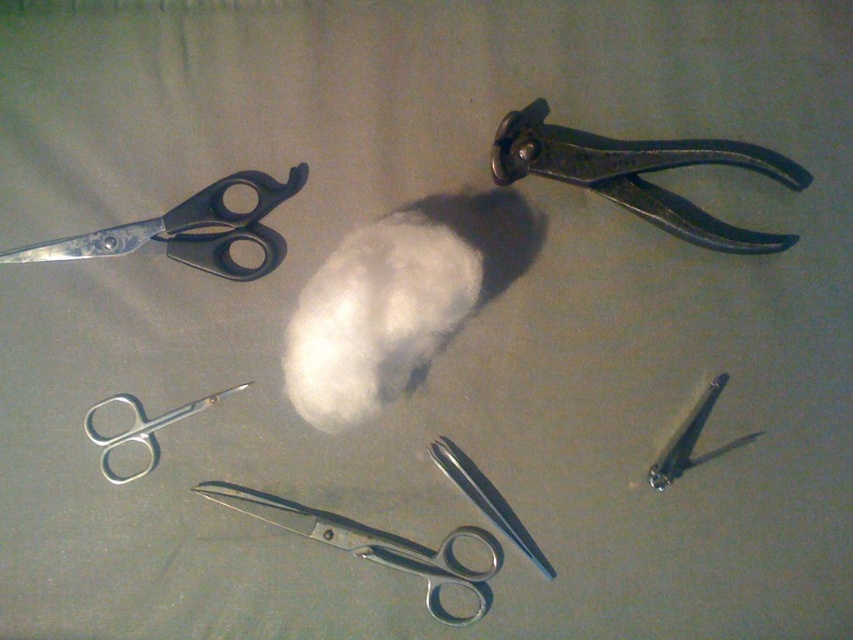
You are organizing tools on a workbench and need to place a new tool between the metallic scissors at center and the metallic silver nail at center. The new tool requires at least 25 centimeters of space. Is there enough space between them?

The distance between the metallic scissors at center and the metallic silver nail at center is 20.37 centimeters, which is less than the required 25 centimeters. Therefore, there is not enough space to place the new tool between them.

You have a small container that can only fit items wider than 5 centimeters. You need to place either the metallic scissors at center or the metallic silver nail at center into it. Which item should you choose?

The metallic scissors at center should be chosen because its width is larger than the metallic silver nail at center, making it more likely to fit in the container that requires items wider than 5 centimeters.

You are organizing tools on a table and need to place a new tool between the dark gray metal pliers at upper right and the metallic scissors at center. Based on their positions, which tool should be placed closer to you?

The dark gray metal pliers at upper right should be placed closer to you since it is already closer to the viewer than the metallic scissors at center.